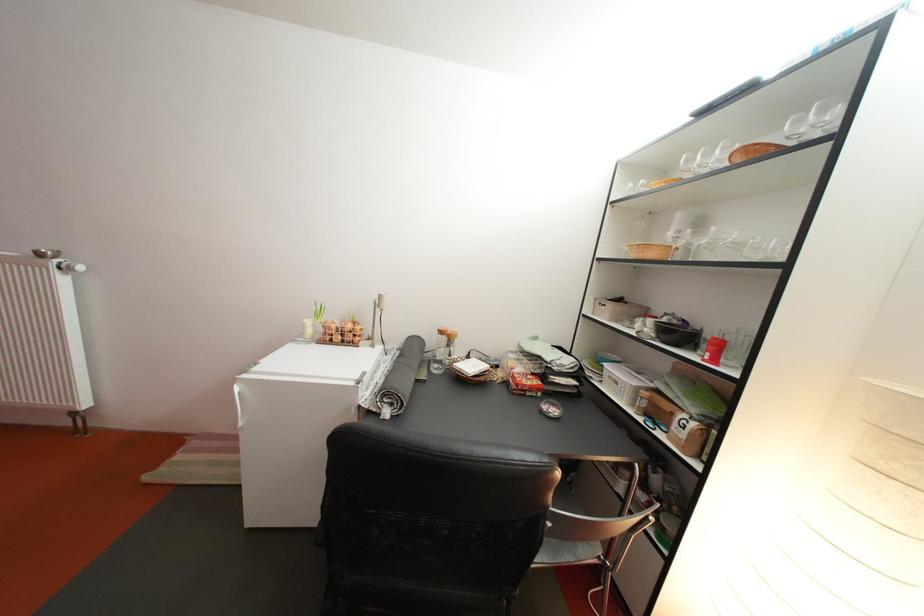
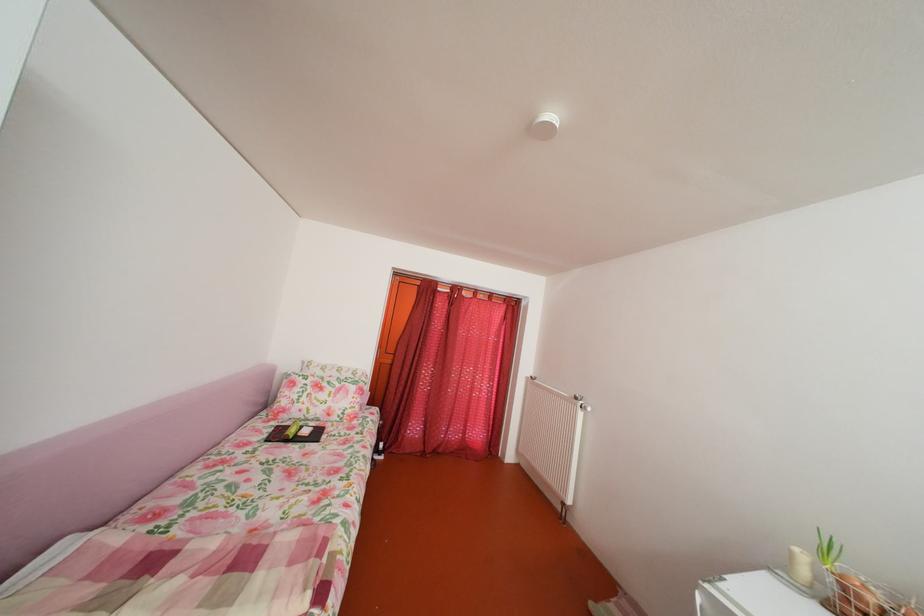
Locate, in the second image, the point that corresponds to point 345,333 in the first image.

(882, 607)